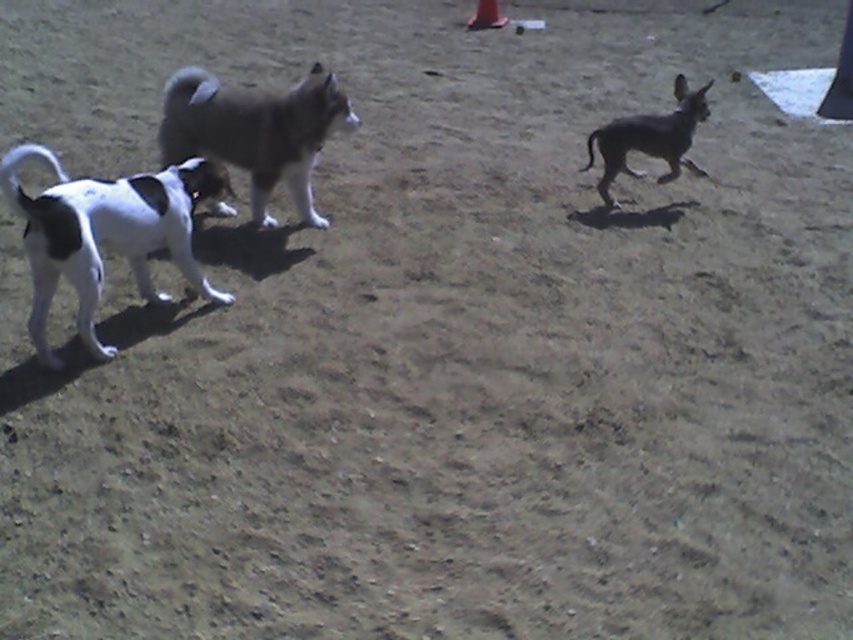
Question: Which of these objects is positioned farthest from the gray fur dog at center?

Choices:
 (A) smooth brown dog at right
 (B) white and black fur dog at left

Answer: (A)

Question: Does smooth brown dog at right appear under orange plastic cone at center?

Choices:
 (A) no
 (B) yes

Answer: (B)

Question: Which object is the closest to the white and black fur dog at left?

Choices:
 (A) smooth brown dog at right
 (B) orange matte cone at upper right
 (C) gray fur dog at center
 (D) orange plastic cone at center

Answer: (C)

Question: Which point appears closest to the camera in this image?

Choices:
 (A) (848, 56)
 (B) (80, 244)

Answer: (B)

Question: Is smooth brown dog at right bigger than orange plastic cone at center?

Choices:
 (A) no
 (B) yes

Answer: (B)

Question: Does white and black fur dog at left have a lesser width compared to orange matte cone at upper right?

Choices:
 (A) yes
 (B) no

Answer: (B)